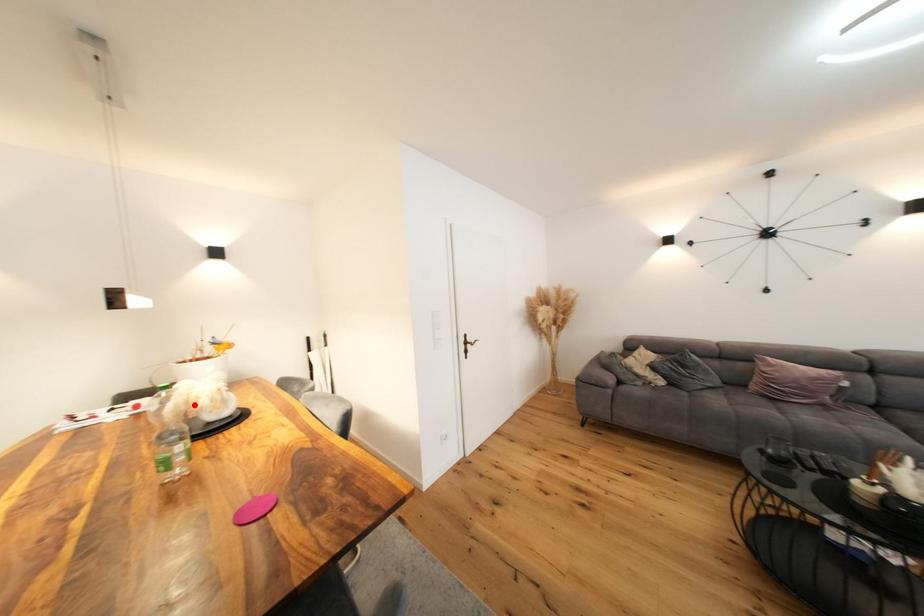
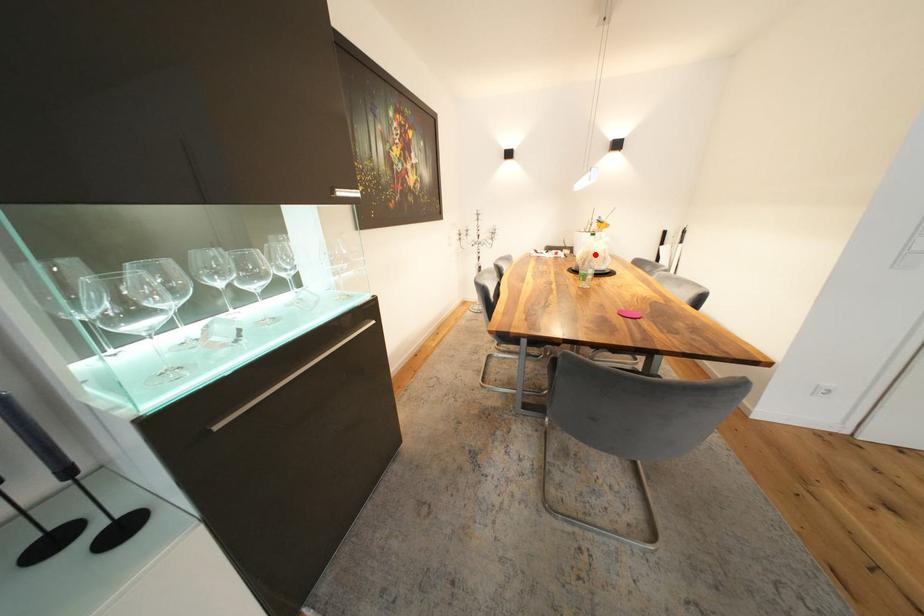
I am providing you with two images of the same scene from different viewpoints. A red point is marked on the first image and another point is marked on the second image. Is the marked point in image1 the same physical position as the marked point in image2?

Yes